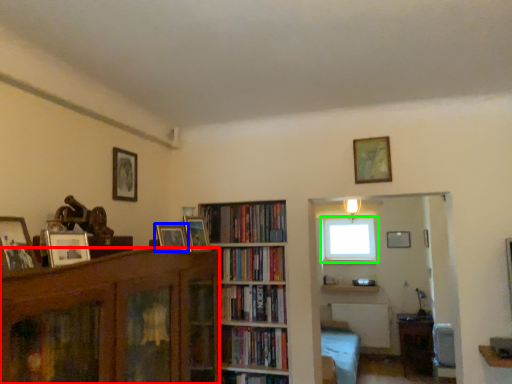
Question: Considering the real-world distances, which object is farthest from bookcase (highlighted by a red box)? picture frame (highlighted by a blue box) or window (highlighted by a green box)?

Choices:
 (A) picture frame
 (B) window

Answer: (B)